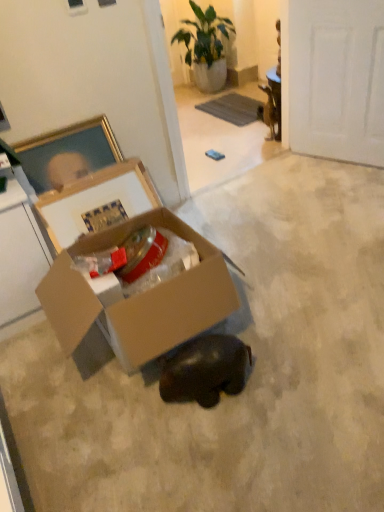
Image resolution: width=384 pixels, height=512 pixels. What do you see at coordinates (205, 46) in the screenshot? I see `green leafy plant at upper center` at bounding box center [205, 46].

The width and height of the screenshot is (384, 512). I want to click on white matte door at upper right, so click(x=337, y=79).

What is the approximate height of shiny black elephant at center?

shiny black elephant at center is 7.39 inches in height.

The width and height of the screenshot is (384, 512). Describe the element at coordinates (205, 370) in the screenshot. I see `shiny black elephant at center` at that location.

Image resolution: width=384 pixels, height=512 pixels. I want to click on cardboard box at center, so click(x=135, y=301).

Looking at this image, is green leafy plant at upper center beside white matte door at upper right?

No, green leafy plant at upper center is not in contact with white matte door at upper right.

How different are the orientations of green leafy plant at upper center and white matte door at upper right in degrees?

green leafy plant at upper center and white matte door at upper right are facing 21.8 degrees away from each other.

From their relative heights in the image, would you say green leafy plant at upper center is taller or shorter than white matte door at upper right?

green leafy plant at upper center is shorter than white matte door at upper right.

From a real-world perspective, which is physically above, green leafy plant at upper center or white matte door at upper right?

white matte door at upper right is physically above.

Is shiny black elephant at center in contact with green leafy plant at upper center?

No, shiny black elephant at center is not touching green leafy plant at upper center.

Between shiny black elephant at center and green leafy plant at upper center, which one has less height?

With less height is shiny black elephant at center.

From a real-world perspective, is shiny black elephant at center positioned above or below green leafy plant at upper center?

shiny black elephant at center is below green leafy plant at upper center.

From a real-world perspective, is white matte door at upper right on shiny black elephant at center?

Yes.

Is white matte door at upper right far away from shiny black elephant at center?

Yes, white matte door at upper right is far from shiny black elephant at center.

Which is less distant, (x=312, y=90) or (x=209, y=382)?

Point (x=312, y=90) is positioned farther from the camera compared to point (x=209, y=382).

You are a GUI agent. You are given a task and a screenshot of the screen. Output one action in this format:
    pyautogui.click(x=<x>, y=<y>)
    Task: Click on the animal located on the left of white matte door at upper right
    
    Given the screenshot: What is the action you would take?
    pyautogui.click(x=205, y=370)

Between green leafy plant at upper center and shiny black elephant at center, which one has less height?

shiny black elephant at center is shorter.

From the image's perspective, is green leafy plant at upper center located beneath shiny black elephant at center?

No, from the image's perspective, green leafy plant at upper center is not beneath shiny black elephant at center.

Based on the photo, how many degrees apart are the facing directions of green leafy plant at upper center and shiny black elephant at center?

The angle between the facing direction of green leafy plant at upper center and the facing direction of shiny black elephant at center is 88.9 degrees.

Could you tell me if green leafy plant at upper center is facing shiny black elephant at center?

No, green leafy plant at upper center is not facing towards shiny black elephant at center.

Can you confirm if cardboard box at center is taller than green leafy plant at upper center?

Incorrect, the height of cardboard box at center is not larger of that of green leafy plant at upper center.

Is cardboard box at center at the right side of green leafy plant at upper center?

No, cardboard box at center is not to the right of green leafy plant at upper center.

Can you tell me how much cardboard box at center and green leafy plant at upper center differ in facing direction?

90.2 degrees.

From a real-world perspective, who is located lower, white matte door at upper right or cardboard box at center?

In real-world perspective, cardboard box at center is lower.

Looking at this image, would you say cardboard box at center is part of white matte door at upper right's contents?

No, cardboard box at center is not surrounded by white matte door at upper right.

What's the angular difference between white matte door at upper right and cardboard box at center's facing directions?

They differ by 68.3 degrees in their facing directions.

Is white matte door at upper right beside cardboard box at center?

No, white matte door at upper right is not beside cardboard box at center.

From a real-world perspective, which object rests below the other?

In real-world perspective, shiny black elephant at center is lower.

Is shiny black elephant at center positioned far away from white matte door at upper right?

Absolutely, shiny black elephant at center is distant from white matte door at upper right.

Locate an element on the screen. This screenshot has height=512, width=384. houseplant that appears on the left of white matte door at upper right is located at coordinates (205, 46).

Identify the location of houseplant lying on the right of shiny black elephant at center. This screenshot has height=512, width=384. (205, 46).

When comparing their distances from shiny black elephant at center, does white matte door at upper right or green leafy plant at upper center seem further?

green leafy plant at upper center lies further to shiny black elephant at center than the other object.

In the scene shown: When comparing their distances from white matte door at upper right, does cardboard box at center or green leafy plant at upper center seem further?

Based on the image, green leafy plant at upper center appears to be further to white matte door at upper right.

Estimate the real-world distances between objects in this image. Which object is closer to cardboard box at center, shiny black elephant at center or green leafy plant at upper center?

shiny black elephant at center lies closer to cardboard box at center than the other object.

Considering their positions, is green leafy plant at upper center positioned further to white matte door at upper right than shiny black elephant at center?

shiny black elephant at center.

Estimate the real-world distances between objects in this image. Which object is further from cardboard box at center, white matte door at upper right or shiny black elephant at center?

Among the two, white matte door at upper right is located further to cardboard box at center.

Based on the photo, estimate the real-world distances between objects in this image. Which object is closer to white matte door at upper right, shiny black elephant at center or cardboard box at center?

cardboard box at center.

Considering their positions, is shiny black elephant at center positioned closer to white matte door at upper right than green leafy plant at upper center?

Based on the image, green leafy plant at upper center appears to be nearer to white matte door at upper right.

Which object lies nearer to the anchor point green leafy plant at upper center, white matte door at upper right or shiny black elephant at center?

The object closer to green leafy plant at upper center is white matte door at upper right.

Identify the location of door between cardboard box at center and green leafy plant at upper center in the front-back direction. (337, 79).

The image size is (384, 512). What are the coordinates of `box between green leafy plant at upper center and shiny black elephant at center in the vertical direction` in the screenshot? It's located at (135, 301).

Where is `box between white matte door at upper right and shiny black elephant at center vertically`? This screenshot has width=384, height=512. box between white matte door at upper right and shiny black elephant at center vertically is located at coordinates (135, 301).

Where is `door between green leafy plant at upper center and shiny black elephant at center from top to bottom`? This screenshot has height=512, width=384. door between green leafy plant at upper center and shiny black elephant at center from top to bottom is located at coordinates (337, 79).